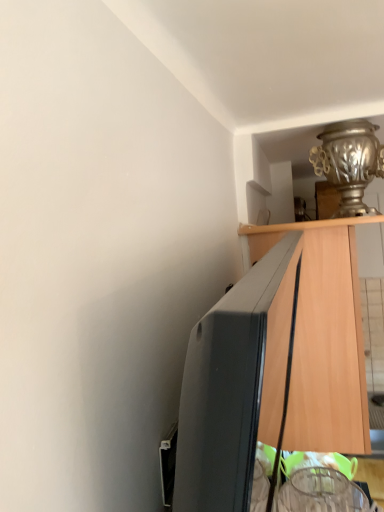
What do you see at coordinates (349, 163) in the screenshot? I see `silver metallic vase at upper right` at bounding box center [349, 163].

Locate an element on the screen. silver metallic vase at upper right is located at coordinates (349, 163).

What is the approximate height of silver metallic vase at upper right?

silver metallic vase at upper right is 10.84 inches tall.

Find the location of a particular element. wooden cabinet at right is located at coordinates (324, 336).

In order to face wooden cabinet at right, should I rotate leftwards or rightwards?

Turn right by 17.689 degrees to look at wooden cabinet at right.

This screenshot has width=384, height=512. What do you see at coordinates (324, 336) in the screenshot?
I see `wooden cabinet at right` at bounding box center [324, 336].

Image resolution: width=384 pixels, height=512 pixels. I want to click on silver metallic vase at upper right, so click(x=349, y=163).

Can you confirm if silver metallic vase at upper right is positioned to the right of wooden cabinet at right?

Incorrect, silver metallic vase at upper right is not on the right side of wooden cabinet at right.

Considering their positions, is silver metallic vase at upper right located in front of or behind wooden cabinet at right?

In the image, silver metallic vase at upper right appears behind wooden cabinet at right.

Considering the points (372, 143) and (315, 247), which point is in front, point (372, 143) or point (315, 247)?

The point (372, 143) is more forward.

From the image's perspective, between silver metallic vase at upper right and wooden cabinet at right, who is located below?

wooden cabinet at right.

From a real-world perspective, which object rests below the other?

wooden cabinet at right is physically lower.

Does silver metallic vase at upper right have a greater width compared to wooden cabinet at right?

No.

Consider the image. Does silver metallic vase at upper right have a lesser height compared to wooden cabinet at right?

Yes, silver metallic vase at upper right is shorter than wooden cabinet at right.

Can you confirm if silver metallic vase at upper right is bigger than wooden cabinet at right?

No, silver metallic vase at upper right is not bigger than wooden cabinet at right.

Is silver metallic vase at upper right inside the boundaries of wooden cabinet at right, or outside?

silver metallic vase at upper right exists outside the volume of wooden cabinet at right.

Is silver metallic vase at upper right not close to wooden cabinet at right?

No, silver metallic vase at upper right is in close proximity to wooden cabinet at right.

Could you tell me if silver metallic vase at upper right is facing wooden cabinet at right?

No, silver metallic vase at upper right does not turn towards wooden cabinet at right.

This screenshot has height=512, width=384. I want to click on lamp that appears behind the wooden cabinet at right, so click(x=349, y=163).

Considering the relative positions of wooden cabinet at right and silver metallic vase at upper right in the image provided, is wooden cabinet at right to the left or to the right of silver metallic vase at upper right?

Clearly, wooden cabinet at right is on the right of silver metallic vase at upper right in the image.

In the image, is wooden cabinet at right positioned in front of or behind silver metallic vase at upper right?

wooden cabinet at right is positioned closer to the viewer than silver metallic vase at upper right.

Between point (350, 380) and point (336, 127), which one is positioned behind?

Positioned behind is point (336, 127).

From the image's perspective, is wooden cabinet at right above or below silver metallic vase at upper right?

wooden cabinet at right is situated lower than silver metallic vase at upper right in the image.

From a real-world perspective, is wooden cabinet at right physically above silver metallic vase at upper right?

No.

Between wooden cabinet at right and silver metallic vase at upper right, which one has larger width?

wooden cabinet at right is wider.

Who is taller, wooden cabinet at right or silver metallic vase at upper right?

wooden cabinet at right.

Considering the sizes of wooden cabinet at right and silver metallic vase at upper right in the image, is wooden cabinet at right bigger or smaller than silver metallic vase at upper right?

Clearly, wooden cabinet at right is larger in size than silver metallic vase at upper right.

In the scene shown: Is wooden cabinet at right located outside silver metallic vase at upper right?

That's correct, wooden cabinet at right is outside of silver metallic vase at upper right.

Is wooden cabinet at right touching silver metallic vase at upper right?

They are not placed beside each other.

Is wooden cabinet at right positioned with its back to silver metallic vase at upper right?

That's not correct — wooden cabinet at right is not looking away from silver metallic vase at upper right.

How many degrees apart are the facing directions of wooden cabinet at right and silver metallic vase at upper right?

There is a 0.892-degree angle between the facing directions of wooden cabinet at right and silver metallic vase at upper right.

I want to click on lamp on the left side of wooden cabinet at right, so click(349, 163).

Locate an element on the screen. The height and width of the screenshot is (512, 384). lamp that appears above the wooden cabinet at right (from the image's perspective) is located at coordinates (349, 163).

Where is `lamp that appears behind the wooden cabinet at right`? The height and width of the screenshot is (512, 384). lamp that appears behind the wooden cabinet at right is located at coordinates (349, 163).